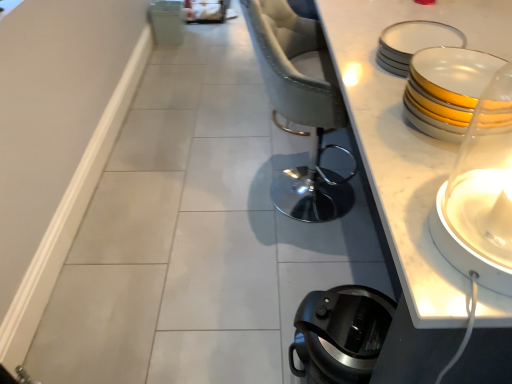
Question: Relative to white glossy candle holder at right, is black plastic coffee pot at lower right in front or behind?

Choices:
 (A) behind
 (B) front

Answer: (A)

Question: Which is correct: black plastic coffee pot at lower right is inside white glossy candle holder at right, or outside of it?

Choices:
 (A) inside
 (B) outside

Answer: (B)

Question: Which of these objects is positioned farthest from the sleek gray fabric chair at center?

Choices:
 (A) white glossy candle holder at right
 (B) black plastic coffee pot at lower right
 (C) white porcelain plates at upper right, which appears as the first tableware when viewed from the back
 (D) white glossy plates at upper right, which appears as the first tableware when viewed from the front

Answer: (A)

Question: Which object is the closest to the white glossy candle holder at right?

Choices:
 (A) white glossy plates at upper right, which appears as the first tableware when viewed from the front
 (B) black plastic coffee pot at lower right
 (C) white porcelain plates at upper right, which appears as the first tableware when viewed from the back
 (D) sleek gray fabric chair at center

Answer: (A)